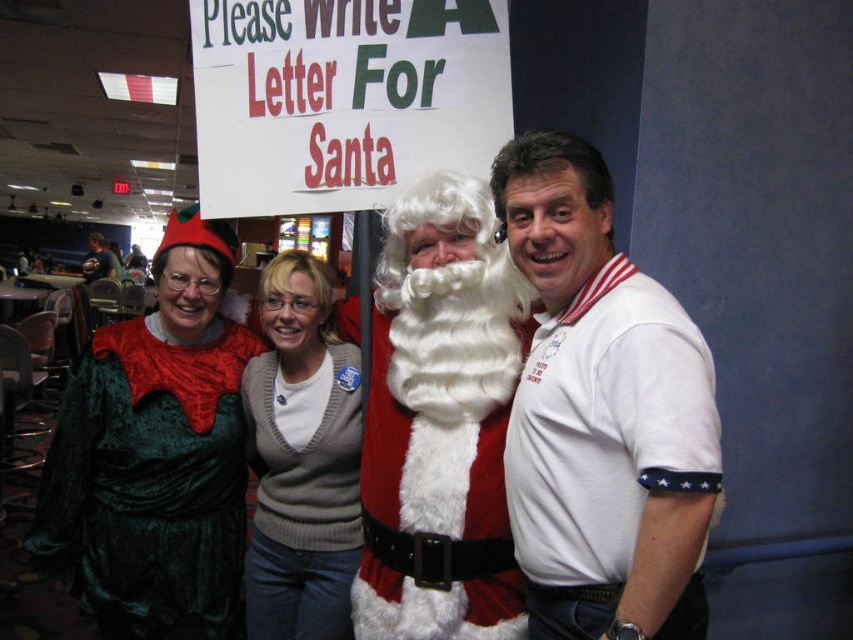
Does white polo shirt at right appear on the left side of knit sweater at center?

In fact, white polo shirt at right is to the right of knit sweater at center.

Between point (689, 451) and point (277, 387), which one is positioned behind?

The point (277, 387) is more distant.

Identify the location of white polo shirt at right. The width and height of the screenshot is (853, 640). (602, 413).

Can you confirm if white fluffy beard at center is bigger than knit sweater at center?

Yes.

Who is lower down, white fluffy beard at center or knit sweater at center?

knit sweater at center is lower down.

Locate an element on the screen. The width and height of the screenshot is (853, 640). white fluffy beard at center is located at coordinates (440, 422).

At what (x,y) coordinates should I click in order to perform the action: click on white fluffy beard at center. Please return your answer as a coordinate pair (x, y). Looking at the image, I should click on (440, 422).

Is white polo shirt at right wider than white fluffy beard at center?

In fact, white polo shirt at right might be narrower than white fluffy beard at center.

Can you confirm if white polo shirt at right is bigger than white fluffy beard at center?

Actually, white polo shirt at right might be smaller than white fluffy beard at center.

Find the location of a particular element. The image size is (853, 640). white polo shirt at right is located at coordinates (602, 413).

This screenshot has width=853, height=640. I want to click on white polo shirt at right, so click(602, 413).